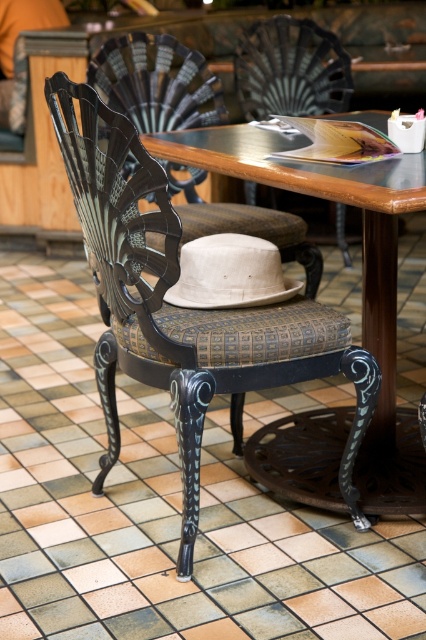
Question: Considering the real-world distances, which object is closest to the wooden table at center?

Choices:
 (A) matte black chair at upper center
 (B) matte black chair at center

Answer: (B)

Question: Which object is the farthest from the matte black chair at upper center?

Choices:
 (A) matte black chair at center
 (B) wooden table at center

Answer: (B)

Question: Among these objects, which one is farthest from the camera?

Choices:
 (A) wooden table at center
 (B) matte black chair at upper center

Answer: (B)

Question: Does wooden table at center have a smaller size compared to matte black chair at center?

Choices:
 (A) no
 (B) yes

Answer: (A)

Question: Is wooden table at center above matte black chair at upper center?

Choices:
 (A) yes
 (B) no

Answer: (B)

Question: In this image, where is wooden table at center located relative to matte black chair at upper center?

Choices:
 (A) left
 (B) right

Answer: (B)